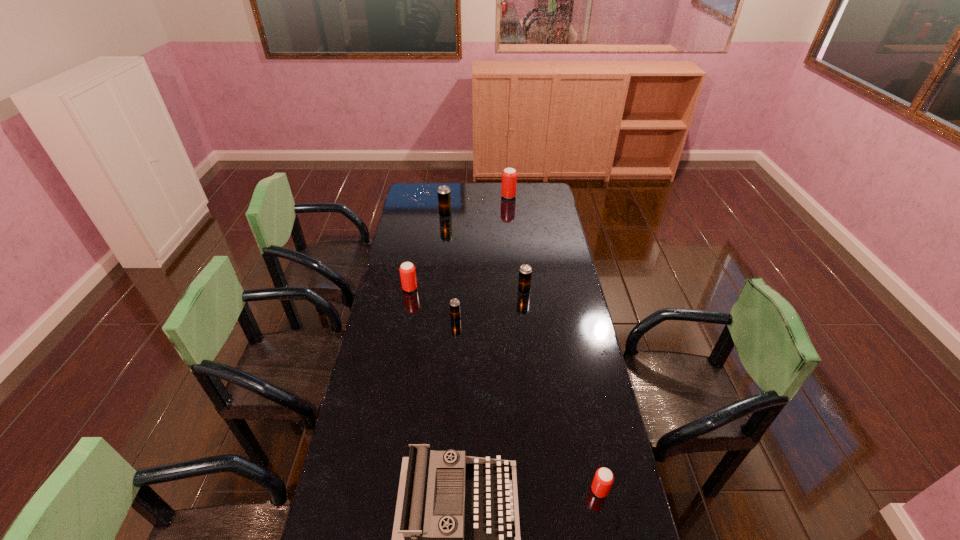
What are the coordinates of `vacant space that satisfies the following two spatial constraints: 1. on the back side of the second farthest black beer can; 2. on the left side of the nearest black beer can` in the screenshot? It's located at (457, 291).